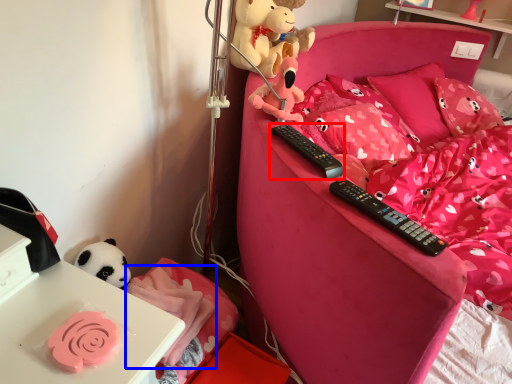
Question: Which object appears farthest to the camera in this image, remote control (highlighted by a red box) or blanket (highlighted by a blue box)?

Choices:
 (A) remote control
 (B) blanket

Answer: (B)